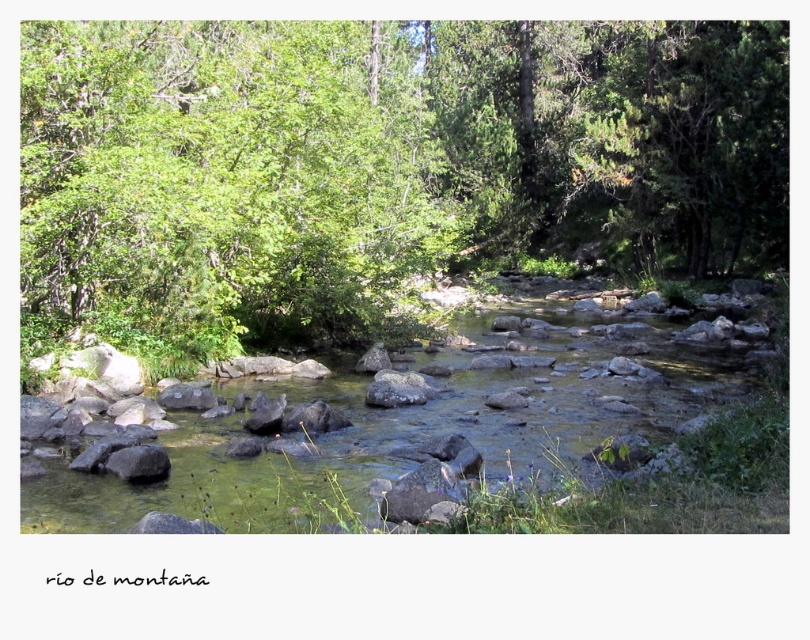
Based on the photo, who is shorter, green leafy tree at center or gray rough rock at lower left?

gray rough rock at lower left

Image resolution: width=810 pixels, height=640 pixels. What do you see at coordinates (384, 161) in the screenshot?
I see `green leafy tree at center` at bounding box center [384, 161].

Measure the distance between point (x=295, y=321) and camera.

Point (x=295, y=321) and camera are 58.25 feet apart.

Find the location of a particular element. green leafy tree at center is located at coordinates (384, 161).